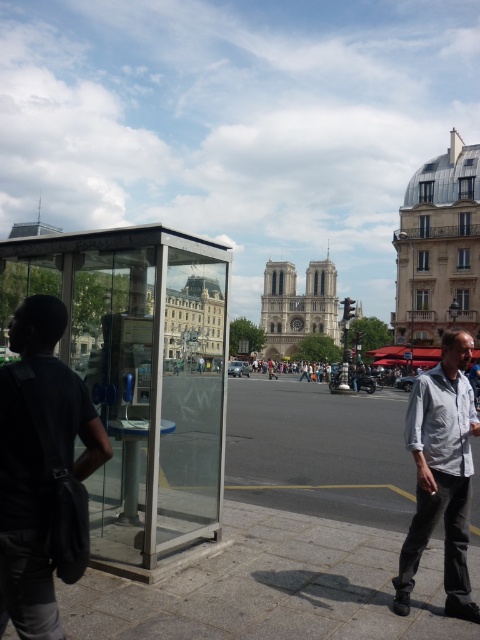
Question: Can you confirm if gray concrete pavement at lower center is smaller than light gray shirt at center?

Choices:
 (A) no
 (B) yes

Answer: (B)

Question: Can you confirm if gray concrete pavement at lower center is wider than dark gray shirt at left?

Choices:
 (A) no
 (B) yes

Answer: (B)

Question: Which object appears farthest from the camera in this image?

Choices:
 (A) dark gray shirt at left
 (B) light gray shirt at center
 (C) transparent glass bus stop at left

Answer: (C)

Question: Which of the following is the farthest from the observer?

Choices:
 (A) gray concrete pavement at lower center
 (B) light gray shirt at center
 (C) transparent glass booth at left

Answer: (C)

Question: Can you confirm if gray concrete pavement at lower center is positioned to the left of light gray shirt at center?

Choices:
 (A) yes
 (B) no

Answer: (A)

Question: Which is nearer to the dark gray shirt at left?

Choices:
 (A) transparent glass bus stop at left
 (B) gray concrete pavement at lower center

Answer: (A)